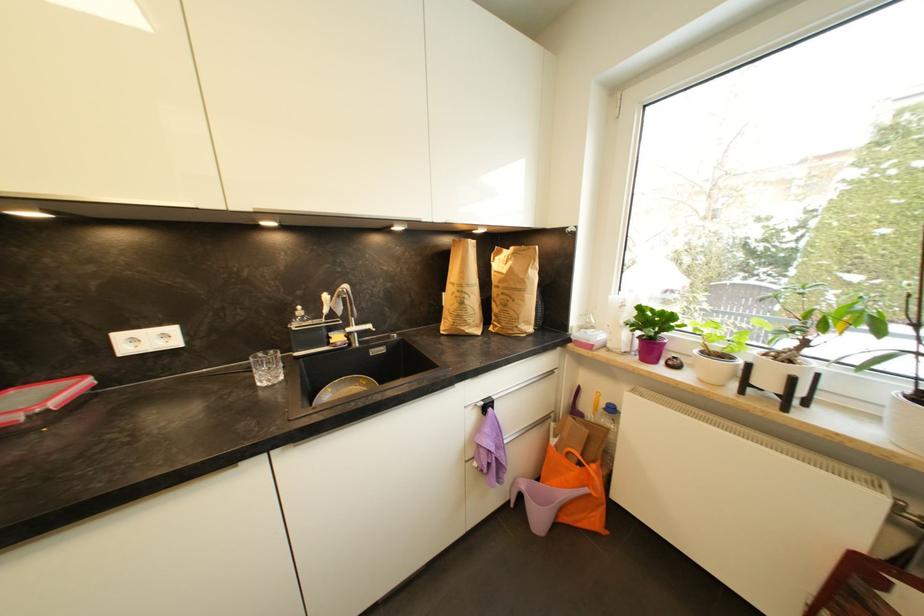
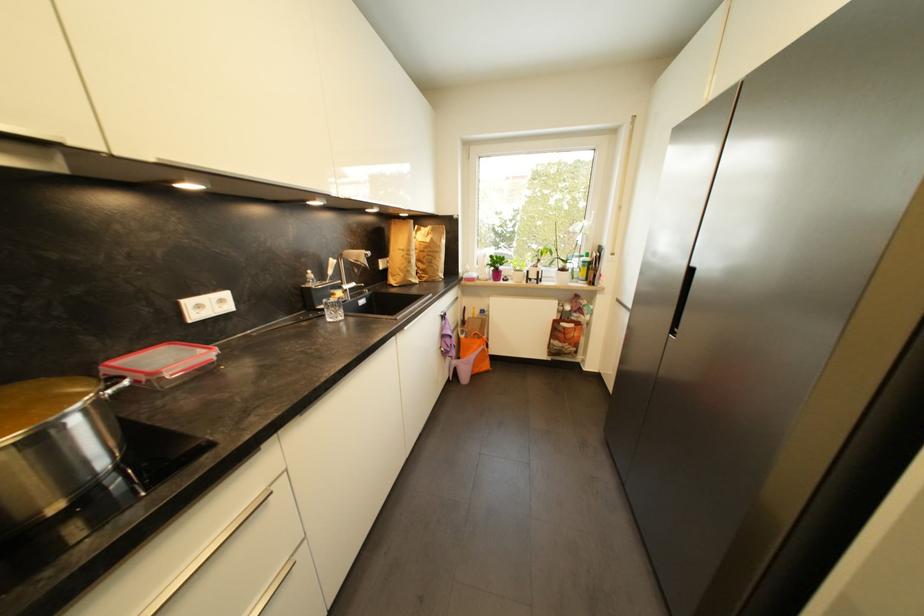
The point at (505,284) is marked in the first image. Where is the corresponding point in the second image?

(430, 249)